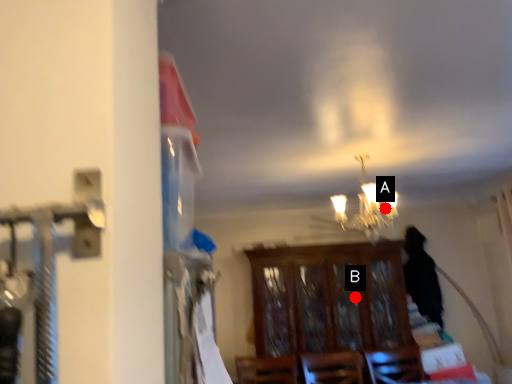
Question: Two points are circled on the image, labeled by A and B beside each circle. Among these points, which one is farthest from the camera?

Choices:
 (A) A is further
 (B) B is further

Answer: (B)